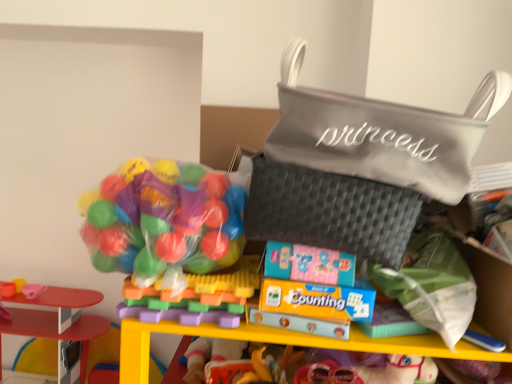
Question: Visually, is green fabric pouch at lower right, which is the 1th pouch in bottom-to-top order, positioned to the left or to the right of smooth plastic toy house at lower left, marked as the second toy in a front-to-back arrangement?

Choices:
 (A) right
 (B) left

Answer: (A)

Question: From the image's perspective, relative to smooth plastic toy house at lower left, which is the second toy in left-to-right order, is green fabric pouch at lower right, the 3th pouch from the top, above or below?

Choices:
 (A) below
 (B) above

Answer: (B)

Question: Based on their relative distances, which object is farther from the smooth plastic cup at left, the second toy in the top-to-bottom sequence?

Choices:
 (A) smooth plastic toy house at lower left, the 2th toy positioned from the right
 (B) gray quilted pouch at upper right, placed as the third pouch when sorted from bottom to top
 (C) matte black pouch at center, positioned as the 2th pouch in top-to-bottom order
 (D) green fabric pouch at lower right, the 3th pouch from the top
 (E) translucent plastic balls at left, the 1th toy viewed from the top

Answer: (B)

Question: Estimate the real-world distances between objects in this image. Which object is farther from the matte black pouch at center, acting as the second pouch starting from the bottom?

Choices:
 (A) translucent plastic balls at left
 (B) smooth plastic cup at left, which is the first toy in back-to-front order
 (C) translucent plastic balls at left, the third toy from the left
 (D) gray quilted pouch at upper right, which ranks as the 1th pouch in top-to-bottom order
 (E) green fabric pouch at lower right, which is the 1th pouch in bottom-to-top order

Answer: (B)